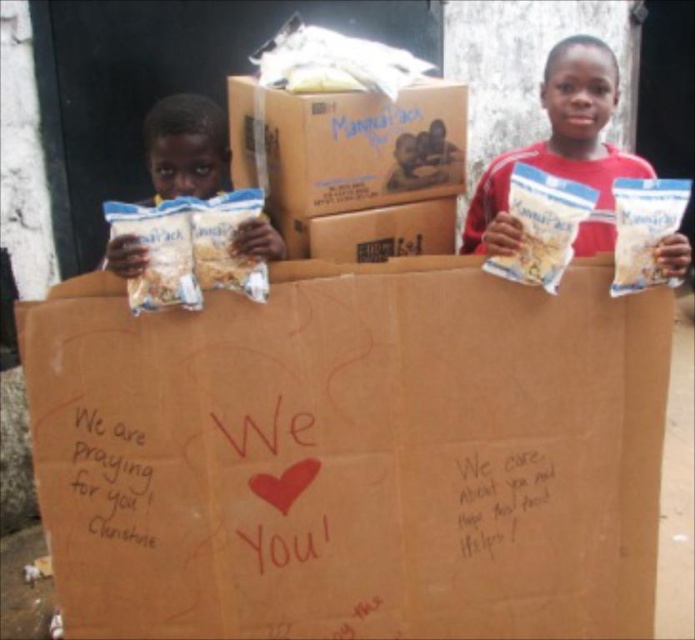
You are organizing a community food drive and need to determine storage space requirements. Given the brown cardboard box at center and the white matte bag at left, which item requires more storage space?

The brown cardboard box at center requires more storage space because it is bigger than the white matte bag at left.

You are a delivery person standing in front of the brown cardboard box at center. Your delivery cart is 1.5 meters away from you. Can you reach the cart without moving your feet?

The distance between you and the brown cardboard box at center is 1.51 meters. Since your cart is only 1.5 meters away from you, you can reach it without moving your feet because the cart is closer than the box.